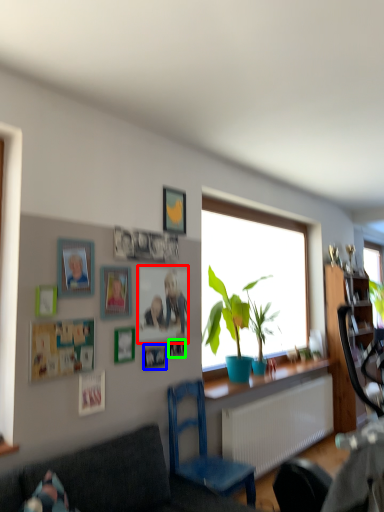
Question: Considering the real-world distances, which object is closest to picture frame (highlighted by a red box)? picture frame (highlighted by a blue box) or picture frame (highlighted by a green box).

Choices:
 (A) picture frame
 (B) picture frame

Answer: (B)